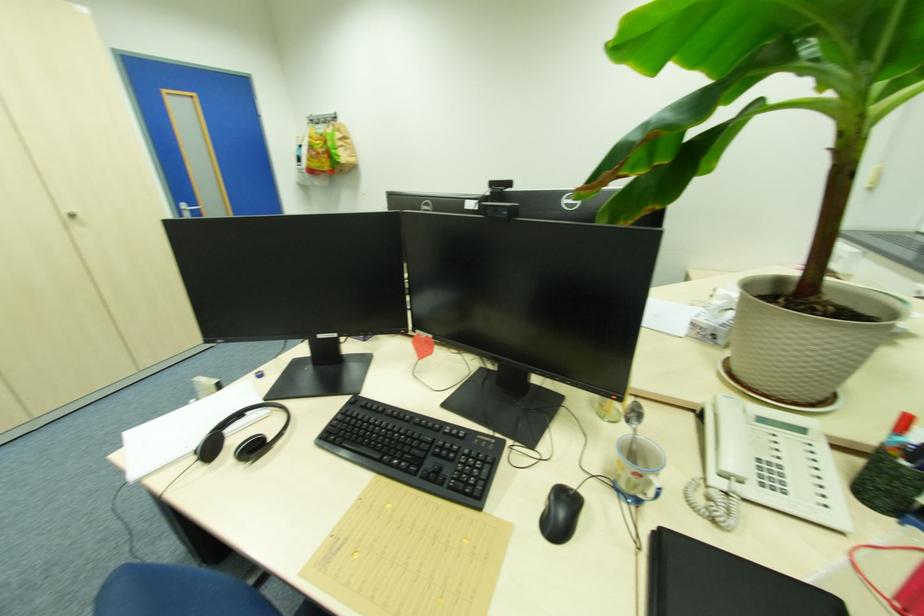
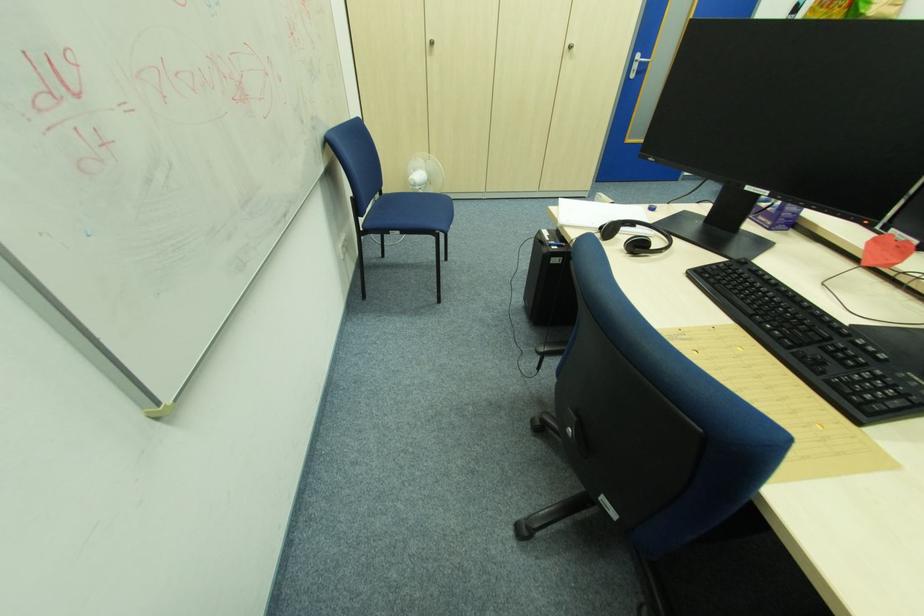
Find the pixel in the second image that matches pixel 119 458 in the first image.

(556, 209)